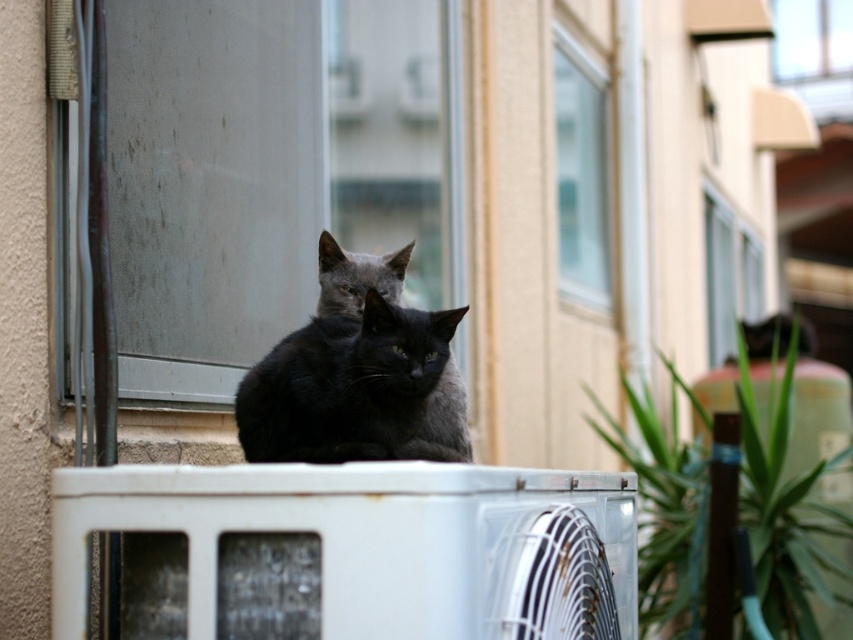
Question: Where is transparent glass window at upper center located in relation to shiny black cat at center in the image?

Choices:
 (A) right
 (B) left

Answer: (B)

Question: Which object appears closest to the camera in this image?

Choices:
 (A) white metallic air conditioner at center
 (B) transparent glass window at upper center
 (C) clear glass window at upper right
 (D) shiny black cat at center

Answer: (A)

Question: Which of the following is the farthest from the observer?

Choices:
 (A) clear glass window at upper right
 (B) shiny black cat at center
 (C) transparent glass window at upper center

Answer: (A)

Question: Which is nearer to the clear glass window at upper center?

Choices:
 (A) shiny black cat at center
 (B) clear glass window at upper right
 (C) transparent glass window at upper center
 (D) white metallic air conditioner at center

Answer: (C)

Question: Does transparent glass window at upper center have a greater width compared to clear glass window at upper center?

Choices:
 (A) no
 (B) yes

Answer: (B)

Question: Does shiny black cat at center appear under clear glass window at upper center?

Choices:
 (A) no
 (B) yes

Answer: (B)